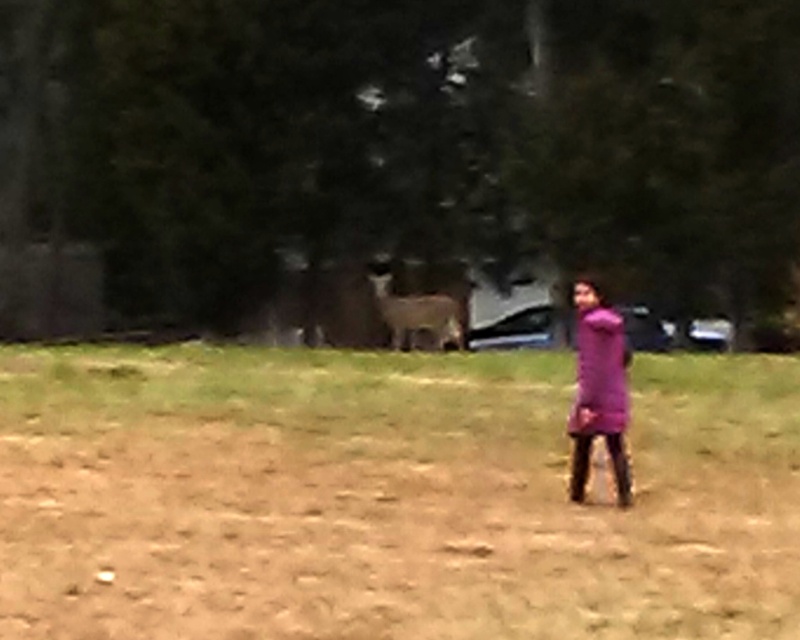
Is brown sandy dirt at center above green grass at center?

No, brown sandy dirt at center is not above green grass at center.

Where is `brown sandy dirt at center`? brown sandy dirt at center is located at coordinates (388, 497).

Can you confirm if green grass at center is wider than purple matte dress at center?

Correct, the width of green grass at center exceeds that of purple matte dress at center.

Which is above, green grass at center or purple matte dress at center?

Positioned higher is green grass at center.

Find the location of `green grass at center`. green grass at center is located at coordinates (290, 387).

Is brown sandy dirt at center taller than purple matte dress at center?

Incorrect, brown sandy dirt at center's height is not larger of purple matte dress at center's.

Does brown sandy dirt at center have a larger size compared to purple matte dress at center?

Indeed, brown sandy dirt at center has a larger size compared to purple matte dress at center.

The height and width of the screenshot is (640, 800). I want to click on brown sandy dirt at center, so click(388, 497).